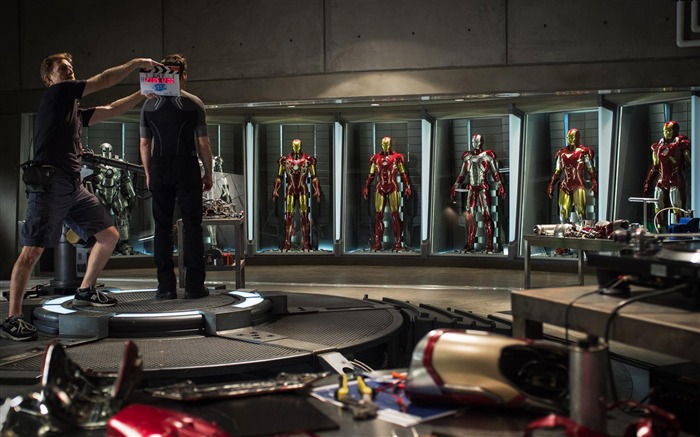
I want to click on wiring, so click(x=624, y=305), click(x=572, y=305).